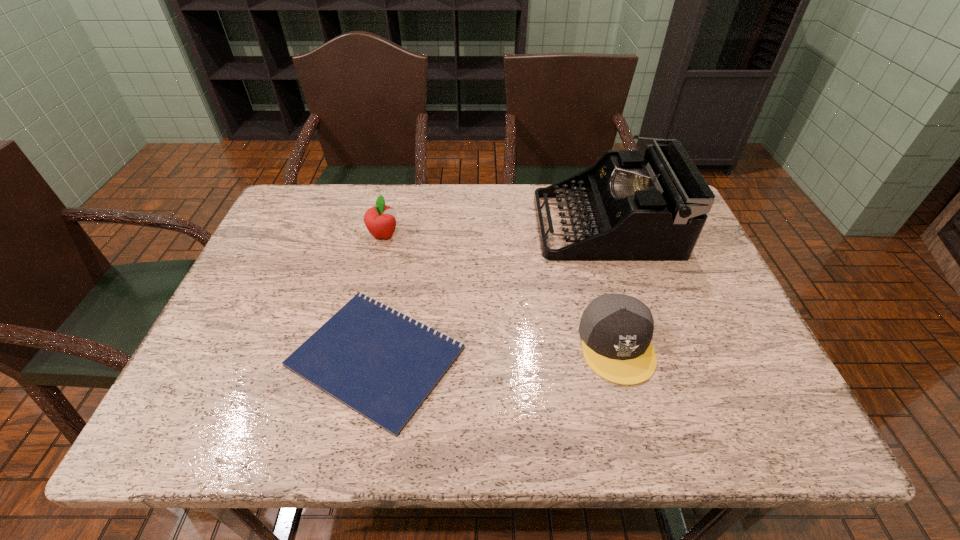
What are the coordinates of `object that is the closest to the third tallest object` in the screenshot? It's located at [653, 208].

Select which object appears as the third closest to the second shortest object. Please provide its 2D coordinates. Your answer should be formatted as a tuple, i.e. [(x, y)], where the tuple contains the x and y coordinates of a point satisfying the conditions above.

[(380, 220)]

Locate an element on the screen. vacant space that satisfies the following two spatial constraints: 1. on the front side of the notepad; 2. on the right side of the apple is located at coordinates (354, 357).

You are a GUI agent. You are given a task and a screenshot of the screen. Output one action in this format:
    pyautogui.click(x=<x>, y=<y>)
    Task: Click on the free space that satisfies the following two spatial constraints: 1. on the typing side of the typewriter; 2. on the front-facing side of the cap
    
    Given the screenshot: What is the action you would take?
    pyautogui.click(x=644, y=345)

At what (x,y) coordinates should I click in order to perform the action: click on vacant point that satisfies the following two spatial constraints: 1. on the typing side of the typewriter; 2. on the front-facing side of the second shortest object. Please return your answer as a coordinate pair (x, y). Looking at the image, I should click on (644, 345).